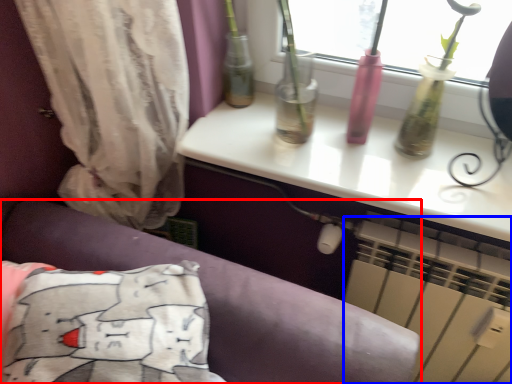
Question: Which object is closer to the camera taking this photo, furniture (highlighted by a red box) or air conditioning (highlighted by a blue box)?

Choices:
 (A) furniture
 (B) air conditioning

Answer: (A)